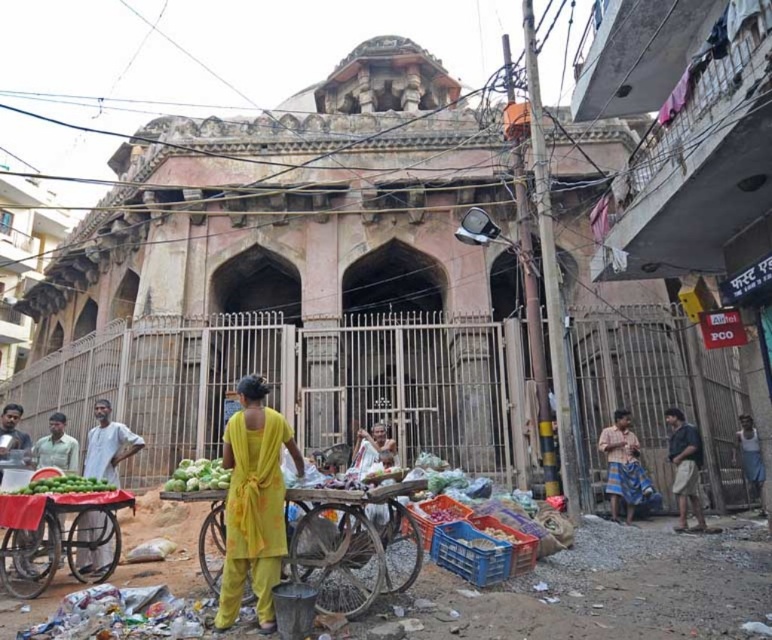
Between point (90, 522) and point (198, 476), which one is positioned behind?

The point (90, 522) is more distant.

Which of these two, light gray cotton shirt at lower left or green matte cabbage at center, stands shorter?

light gray cotton shirt at lower left

Between point (127, 444) and point (210, 461), which one is positioned behind?

The point (127, 444) is more distant.

Locate an element on the screen. The image size is (772, 640). light gray cotton shirt at lower left is located at coordinates (107, 444).

Does light gray cotton shirt at lower left appear over striped fabric pants at lower right?

Yes.

Can you confirm if light gray cotton shirt at lower left is bigger than striped fabric pants at lower right?

Incorrect, light gray cotton shirt at lower left is not larger than striped fabric pants at lower right.

Between point (103, 404) and point (611, 436), which one is positioned in front?

Positioned in front is point (103, 404).

This screenshot has width=772, height=640. Find the location of `light gray cotton shirt at lower left`. light gray cotton shirt at lower left is located at coordinates (107, 444).

Does point (696, 504) come closer to viewer compared to point (90, 486)?

No, it is behind (90, 486).

Is the position of dark green fabric at right less distant than that of green matte limes at lower left?

That is False.

Is point (686, 435) more distant than point (73, 483)?

Yes, it is.

What are the coordinates of `dark green fabric at right` in the screenshot? It's located at (684, 467).